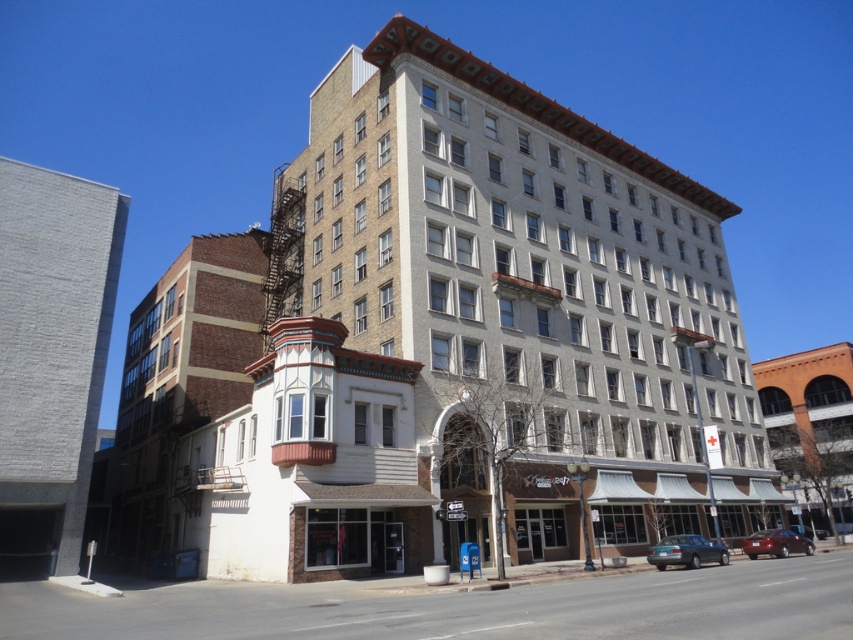
You are a delivery driver who needs to park your matte black sedan at lower center near the brown brick building at center. Can you park your car directly in front of the building?

The brown brick building at center is to the right of the matte black sedan at lower center, so the sedan is already positioned to the left of the building. To park directly in front, you would need to move the sedan straight forward without changing its lateral position, ensuring it aligns with the center of the building.

You are standing at a safe distance from the building and want to take a photo of the point at coordinates point (155, 452). If your camera has a maximum zoom range of 50 meters, will you be able to capture the point clearly in your photo?

The point (155, 452) is 54.77 meters away from you, which exceeds the camera maximum zoom range of 50 meters. Therefore, you will not be able to capture the point clearly in your photo.

You are standing at the center of the image. Which direction should you look to see the brown brick building at left?

You should look to the left to see the brown brick building at left as it is positioned at point (181, 380), which is to the left of the center.